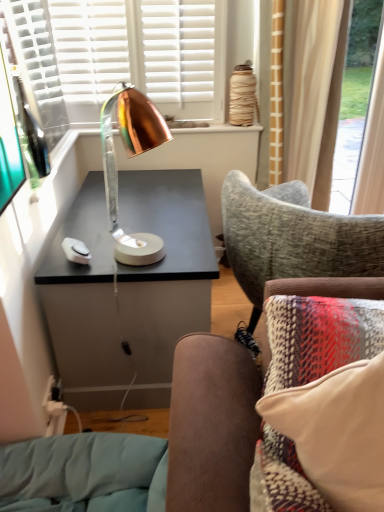
Question: In terms of width, does white soft pillow at lower right look wider or thinner when compared to copper metallic lamp at center?

Choices:
 (A) wide
 (B) thin

Answer: (A)

Question: Is white soft pillow at lower right inside or outside of copper metallic lamp at center?

Choices:
 (A) inside
 (B) outside

Answer: (B)

Question: From a real-world perspective, is white soft pillow at lower right above or below copper metallic lamp at center?

Choices:
 (A) below
 (B) above

Answer: (A)

Question: From the image's perspective, relative to white soft pillow at lower right, is copper metallic lamp at center above or below?

Choices:
 (A) below
 (B) above

Answer: (B)

Question: Does point tap(117, 209) appear closer or farther from the camera than point tap(360, 468)?

Choices:
 (A) farther
 (B) closer

Answer: (A)

Question: From a real-world perspective, relative to white soft pillow at lower right, is copper metallic lamp at center vertically above or below?

Choices:
 (A) above
 (B) below

Answer: (A)

Question: In terms of height, does copper metallic lamp at center look taller or shorter compared to white soft pillow at lower right?

Choices:
 (A) short
 (B) tall

Answer: (B)